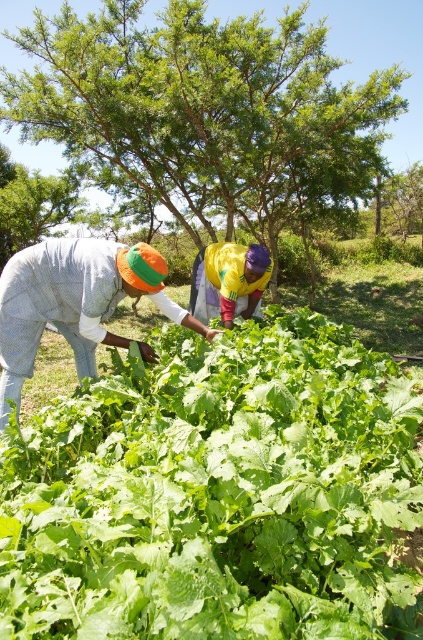
Can you confirm if green leafy vegetable at center is positioned above textured cotton shirt at lower left?

No, green leafy vegetable at center is not above textured cotton shirt at lower left.

Can you confirm if green leafy vegetable at center is taller than textured cotton shirt at lower left?

In fact, green leafy vegetable at center may be shorter than textured cotton shirt at lower left.

Is point (335, 330) less distant than point (19, 328)?

That is False.

The image size is (423, 640). What are the coordinates of `green leafy vegetable at center` in the screenshot? It's located at (217, 493).

The image size is (423, 640). What do you see at coordinates (74, 301) in the screenshot?
I see `textured cotton shirt at lower left` at bounding box center [74, 301].

Does textured cotton shirt at lower left appear on the left side of yellow fabric at center?

Yes, textured cotton shirt at lower left is to the left of yellow fabric at center.

Which is behind, point (19, 404) or point (225, 246)?

The point (225, 246) is more distant.

Where is `textured cotton shirt at lower left`? This screenshot has width=423, height=640. textured cotton shirt at lower left is located at coordinates (74, 301).

Describe the element at coordinates (217, 493) in the screenshot. The height and width of the screenshot is (640, 423). I see `green leafy vegetable at center` at that location.

Does green leafy vegetable at center appear over yellow fabric at center?

Actually, green leafy vegetable at center is below yellow fabric at center.

Which is in front, point (19, 627) or point (216, 269)?

Positioned in front is point (19, 627).

Where is `green leafy vegetable at center`? The height and width of the screenshot is (640, 423). green leafy vegetable at center is located at coordinates (217, 493).